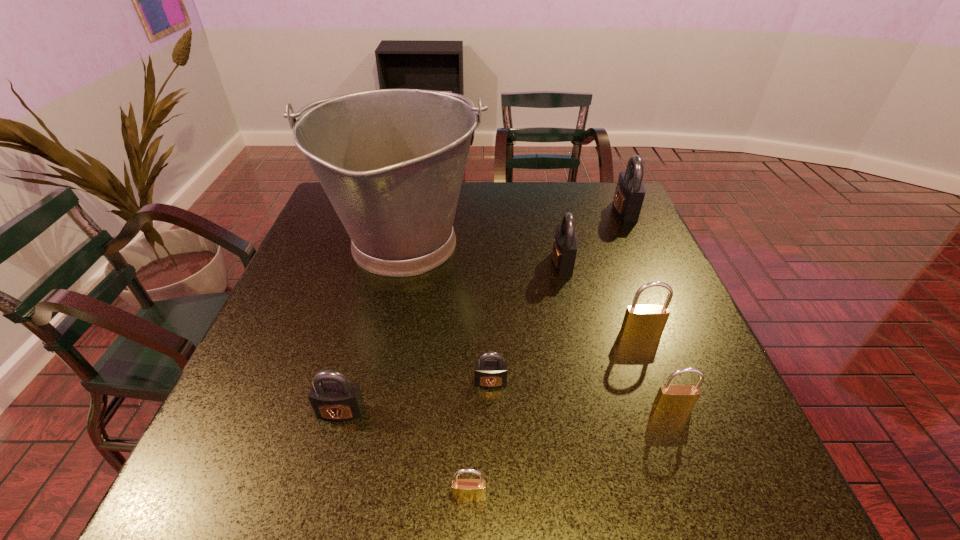
Image resolution: width=960 pixels, height=540 pixels. I want to click on object that is at the far right corner, so click(630, 190).

Find the location of a particular element. This screenshot has width=960, height=540. free space at the far edge is located at coordinates (537, 188).

The image size is (960, 540). Find the location of `vacant area at the near edge of the desktop`. vacant area at the near edge of the desktop is located at coordinates (670, 501).

Where is `free region at the left edge of the desktop`? The image size is (960, 540). free region at the left edge of the desktop is located at coordinates (330, 300).

The height and width of the screenshot is (540, 960). In the image, there is a desktop. What are the coordinates of `free space at the right edge` in the screenshot? It's located at (645, 371).

What are the coordinates of `vacant region at the near left corner of the desktop` in the screenshot? It's located at (186, 504).

Locate an element on the screen. The width and height of the screenshot is (960, 540). free space between the third gray padlock from left to right and the second gray padlock from left to right is located at coordinates (526, 322).

The height and width of the screenshot is (540, 960). Find the location of `vacant space that's between the third gray padlock from left to right and the farthest brass padlock`. vacant space that's between the third gray padlock from left to right and the farthest brass padlock is located at coordinates (602, 298).

You are a GUI agent. You are given a task and a screenshot of the screen. Output one action in this format:
    pyautogui.click(x=<x>, y=<y>)
    Task: Click on the free point between the second gray padlock from right to left and the bucket
    This screenshot has height=540, width=960.
    Given the screenshot: What is the action you would take?
    pyautogui.click(x=483, y=254)

At what (x,y) coordinates should I click in order to perform the action: click on empty space that is in between the nearest padlock and the farthest brass padlock. Please return your answer as a coordinate pair (x, y). Image resolution: width=960 pixels, height=540 pixels. Looking at the image, I should click on (555, 415).